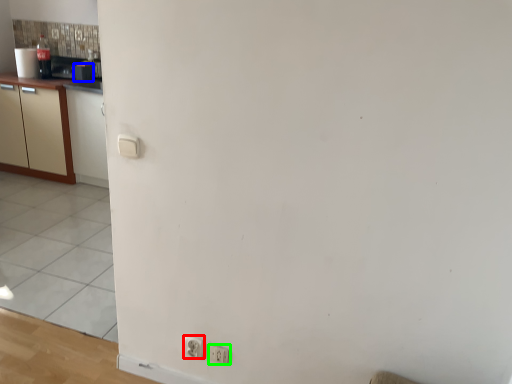
Question: Estimate the real-world distances between objects in this image. Which object is farther from electric outlet (highlighted by a red box), appliance (highlighted by a blue box) or electric outlet (highlighted by a green box)?

Choices:
 (A) appliance
 (B) electric outlet

Answer: (A)